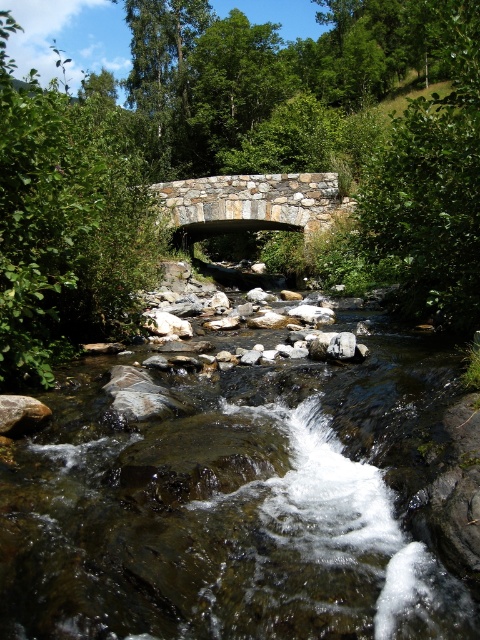
Question: Is gray rock at lower left bigger than smooth gray rock at center?

Choices:
 (A) yes
 (B) no

Answer: (B)

Question: Which object appears closest to the camera in this image?

Choices:
 (A) smooth gray rock at center
 (B) gray rock at lower left

Answer: (B)

Question: Is gray rock at lower left closer to the viewer compared to smooth gray rock at center?

Choices:
 (A) yes
 (B) no

Answer: (A)

Question: Is gray rock at lower left below smooth gray rock at center?

Choices:
 (A) no
 (B) yes

Answer: (B)

Question: Which point is closer to the camera?

Choices:
 (A) (19, 406)
 (B) (310, 353)

Answer: (A)